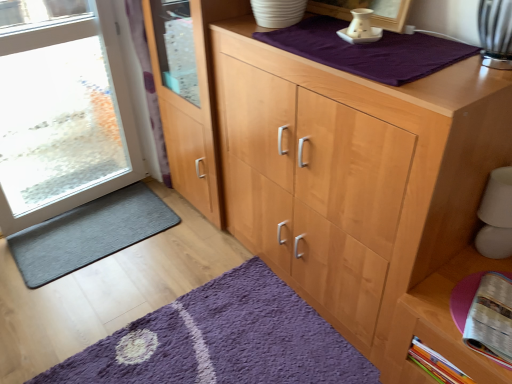
This screenshot has width=512, height=384. I want to click on blank area beneath purple cotton blanket at upper center (from a real-world perspective), so click(360, 51).